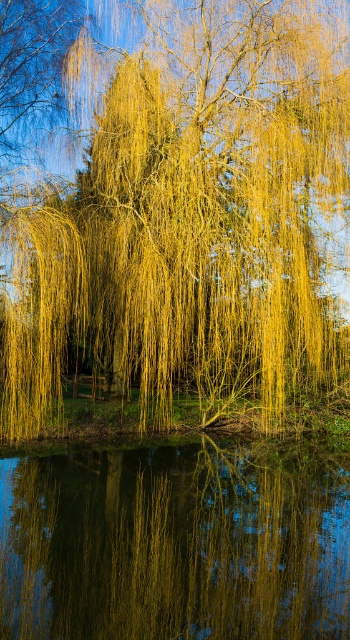
Question: Can you confirm if smooth reflective water at center is thinner than wooden park bench at center?

Choices:
 (A) yes
 (B) no

Answer: (B)

Question: Which object is positioned farthest from the wooden park bench at center?

Choices:
 (A) smooth reflective water at center
 (B) yellow-green silky willow at center

Answer: (A)

Question: Which object is farther from the camera taking this photo?

Choices:
 (A) smooth reflective water at center
 (B) yellow-green silky willow at center

Answer: (B)

Question: Is smooth reflective water at center positioned in front of wooden park bench at center?

Choices:
 (A) yes
 (B) no

Answer: (A)

Question: Which object appears closest to the camera in this image?

Choices:
 (A) smooth reflective water at center
 (B) wooden park bench at center

Answer: (A)

Question: Is yellow-green silky willow at center positioned at the back of smooth reflective water at center?

Choices:
 (A) no
 (B) yes

Answer: (B)